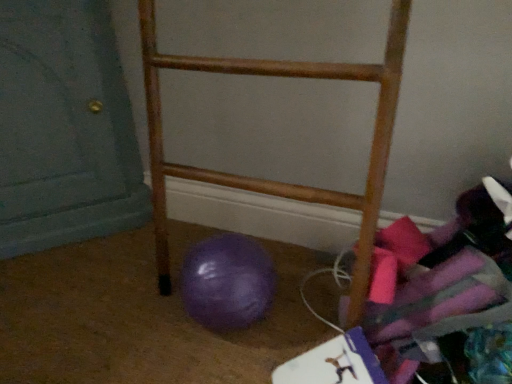
At what (x,y) coordinates should I click in order to perform the action: click on free space that is in between purple rubber ball at lower left and matte teal door at lower left. Please return your answer as a coordinate pair (x, y). Looking at the image, I should click on pyautogui.click(x=136, y=288).